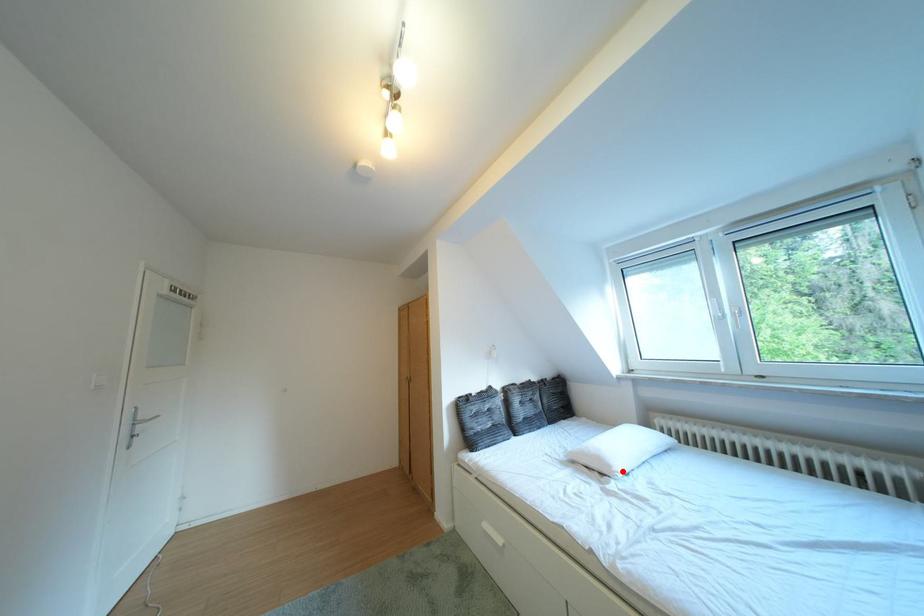
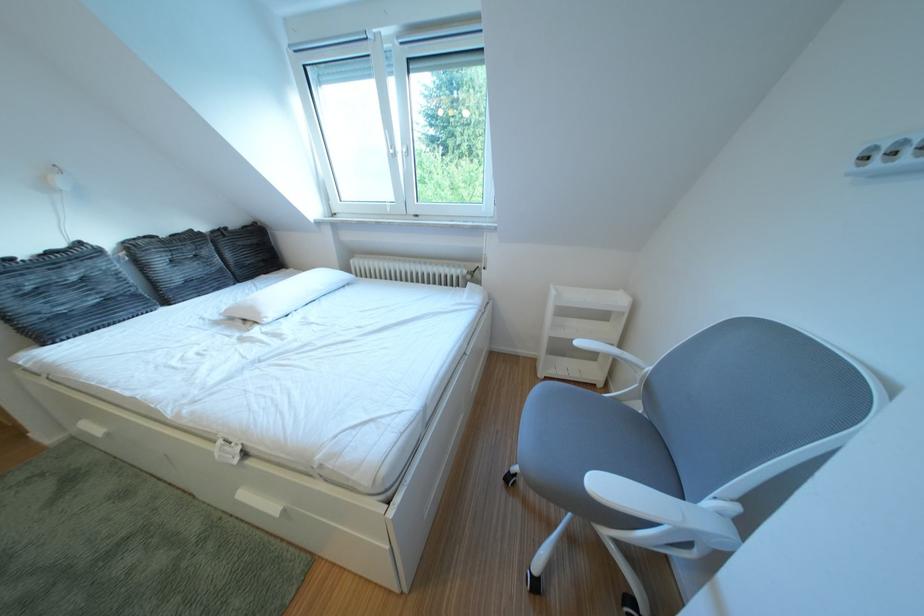
Question: I am providing you with two images of the same scene from different viewpoints. Given a red point in image1, look at the same physical point in image2. Is it:

Choices:
 (A) Closer to the viewpoint
 (B) Farther from the viewpoint

Answer: (A)